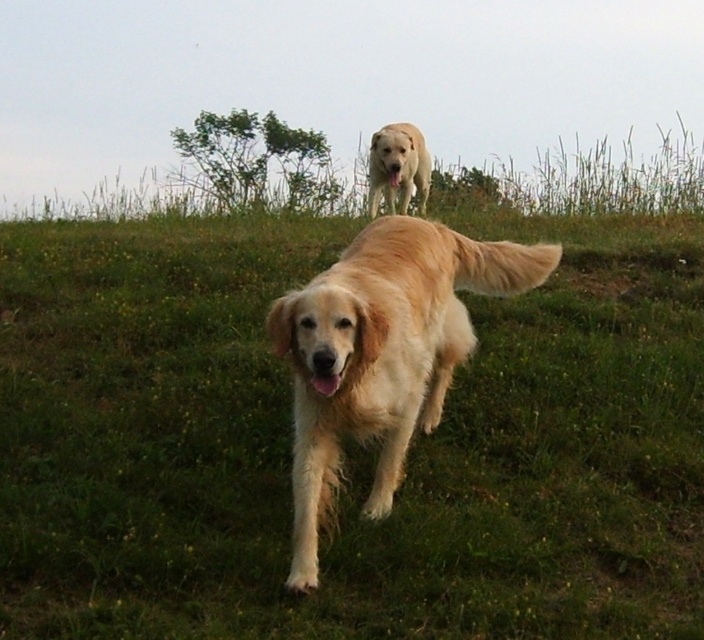
Is the position of golden soft fur dog at center more distant than that of golden fur dog at upper center?

No, it is in front of golden fur dog at upper center.

Is the position of golden soft fur dog at center less distant than that of golden fur dog at upper center?

Yes, golden soft fur dog at center is in front of golden fur dog at upper center.

Where is `golden soft fur dog at center`? The image size is (704, 640). golden soft fur dog at center is located at coordinates (382, 353).